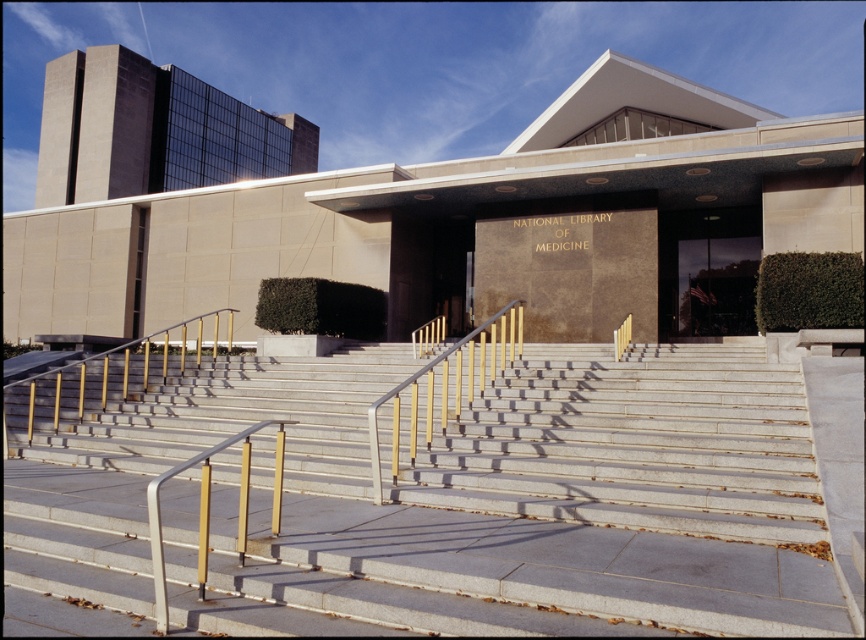
Question: Does granite stairs at center appear on the left side of glass door at center?

Choices:
 (A) no
 (B) yes

Answer: (B)

Question: Is glass door at center positioned in front of gold metallic railing at center?

Choices:
 (A) no
 (B) yes

Answer: (A)

Question: Which object is positioned closest to the gold metallic railing at center?

Choices:
 (A) glass door at center
 (B) granite stairs at center
 (C) gold metallic handrail at lower left

Answer: (B)

Question: Which object is the farthest from the gold metallic railing at center?

Choices:
 (A) granite stairs at center
 (B) gold metallic handrail at lower left

Answer: (B)

Question: Among these objects, which one is nearest to the camera?

Choices:
 (A) granite stairs at center
 (B) gold metallic railing at center
 (C) gold metallic handrail at lower left

Answer: (A)

Question: Is granite stairs at center below glass door at center?

Choices:
 (A) no
 (B) yes

Answer: (B)